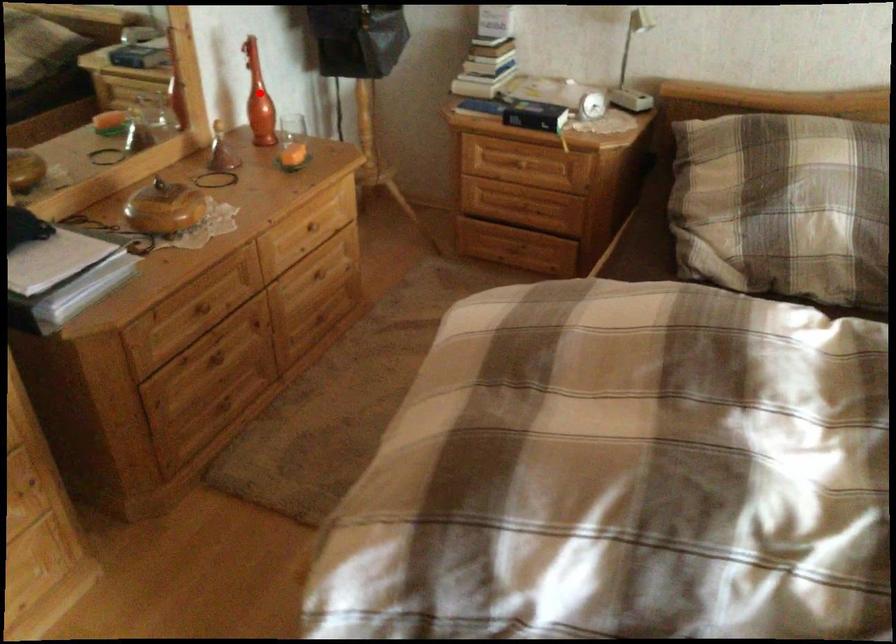
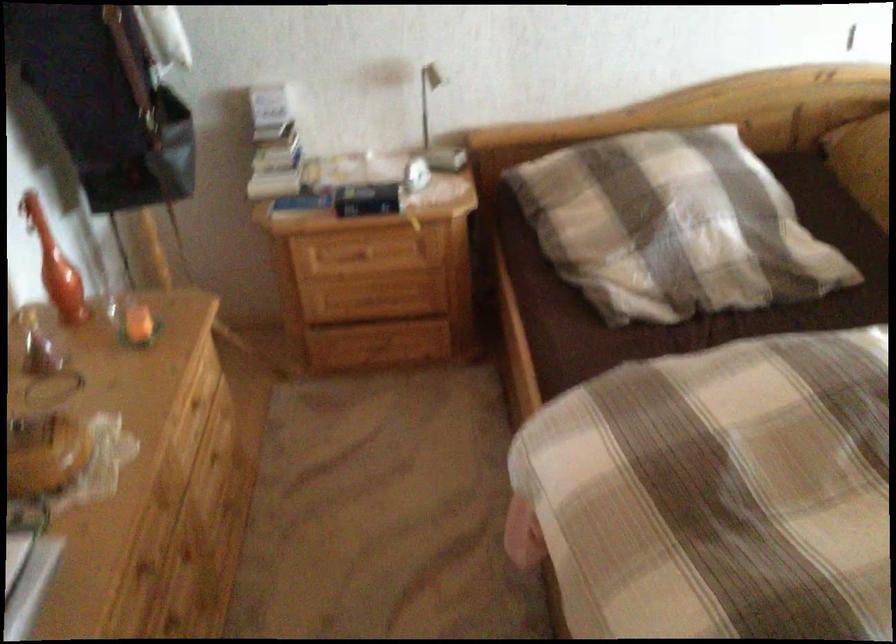
In the second image, find the point that corresponds to the highlighted location in the first image.

(55, 265)